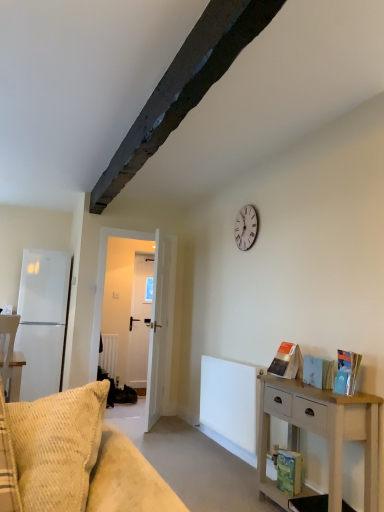
Question: From the image's perspective, does white ribbed radiator at center appear higher than hardcover book at lower right, the first book ordered from the bottom?

Choices:
 (A) no
 (B) yes

Answer: (B)

Question: Can you confirm if white ribbed radiator at center is positioned to the left of hardcover book at lower right, the first book ordered from the bottom?

Choices:
 (A) yes
 (B) no

Answer: (A)

Question: Is the surface of white ribbed radiator at center in direct contact with hardcover book at lower right, the second book when ordered from back to front?

Choices:
 (A) yes
 (B) no

Answer: (B)

Question: Can hardcover book at lower right, the fourth book positioned from the top, be found inside white ribbed radiator at center?

Choices:
 (A) no
 (B) yes

Answer: (A)

Question: Does white ribbed radiator at center come behind hardcover book at lower right, the second book when ordered from back to front?

Choices:
 (A) no
 (B) yes

Answer: (B)

Question: Considering the relative sizes of white ribbed radiator at center and hardcover book at lower right, the fourth book positioned from the top, in the image provided, is white ribbed radiator at center smaller than hardcover book at lower right, the fourth book positioned from the top,?

Choices:
 (A) no
 (B) yes

Answer: (A)

Question: From the image's perspective, is hardcover book at lower right, placed as the 3th book when sorted from front to back, under hardcover book at right, positioned as the 1th book in top-to-bottom order?

Choices:
 (A) yes
 (B) no

Answer: (A)

Question: Are hardcover book at lower right, placed as the 3th book when sorted from front to back, and hardcover book at right, positioned as the fourth book in bottom-to-top order, far apart?

Choices:
 (A) no
 (B) yes

Answer: (A)

Question: Does hardcover book at lower right, placed as the 3th book when sorted from front to back, appear on the left side of hardcover book at right, the 1th book from the front?

Choices:
 (A) yes
 (B) no

Answer: (A)

Question: Is hardcover book at lower right, the fourth book positioned from the top, oriented towards hardcover book at right, marked as the 4th book in a back-to-front arrangement?

Choices:
 (A) yes
 (B) no

Answer: (B)

Question: Is hardcover book at right, positioned as the 1th book in top-to-bottom order, at the back of hardcover book at lower right, the fourth book positioned from the top?

Choices:
 (A) yes
 (B) no

Answer: (B)

Question: Considering the relative sizes of hardcover book at lower right, the first book ordered from the bottom, and hardcover book at right, positioned as the 1th book in top-to-bottom order, in the image provided, is hardcover book at lower right, the first book ordered from the bottom, thinner than hardcover book at right, positioned as the 1th book in top-to-bottom order,?

Choices:
 (A) yes
 (B) no

Answer: (A)

Question: Does white wooden door at center have a smaller size compared to white matte refrigerator at left?

Choices:
 (A) no
 (B) yes

Answer: (B)